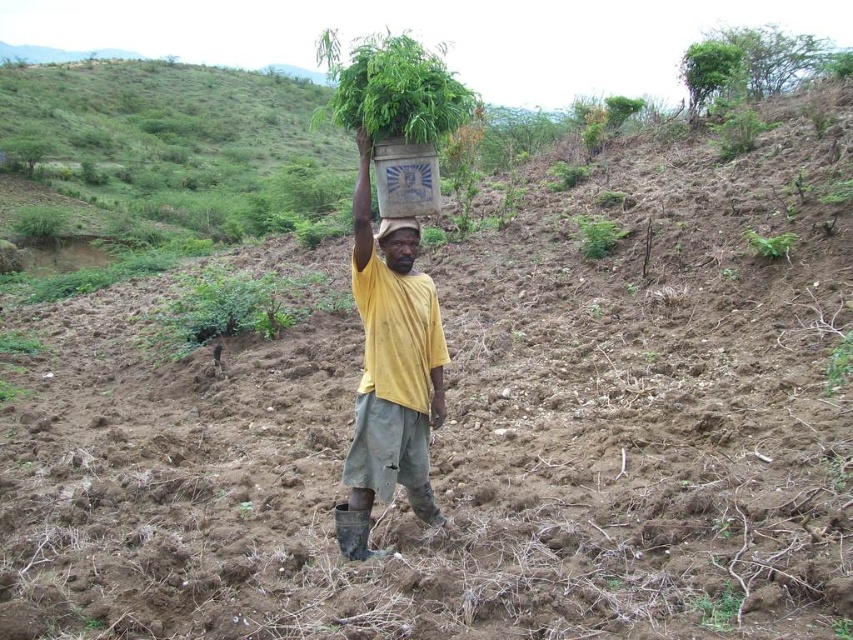
Question: Is green leafy plant at center positioned at the back of green leafy plant at upper right?

Choices:
 (A) yes
 (B) no

Answer: (A)

Question: Which point appears closest to the camera in this image?

Choices:
 (A) (403, 252)
 (B) (769, 240)
 (C) (384, 452)
 (D) (706, 620)

Answer: (D)

Question: Considering the real-world distances, which object is closest to the green leafy plant at center?

Choices:
 (A) yellow matte shirt at center
 (B) green leafy plant at upper right
 (C) yellow fabric head at center
 (D) green leafy plant at lower right

Answer: (B)

Question: Does yellow matte shirt at center have a lesser width compared to green leafy plant at lower right?

Choices:
 (A) no
 (B) yes

Answer: (A)

Question: Is yellow matte shirt at center positioned behind yellow fabric head at center?

Choices:
 (A) no
 (B) yes

Answer: (A)

Question: Which object is positioned closest to the green leafy plant at center?

Choices:
 (A) yellow fabric head at center
 (B) green leafy plant at upper right
 (C) green leafy plant at lower right

Answer: (B)